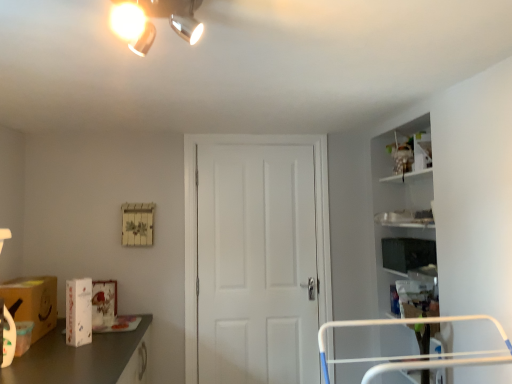
The image size is (512, 384). Describe the element at coordinates (407, 253) in the screenshot. I see `matte black tv at right, acting as the first box starting from the right` at that location.

The image size is (512, 384). What are the coordinates of `matte black tv at right, which ranks as the 1th box in back-to-front order` in the screenshot? It's located at (407, 253).

You are a GUI agent. You are given a task and a screenshot of the screen. Output one action in this format:
    pyautogui.click(x=<x>, y=<y>)
    Task: Click on the white matte door at center
    
    Given the screenshot: What is the action you would take?
    pyautogui.click(x=195, y=225)

Image resolution: width=512 pixels, height=384 pixels. What do you see at coordinates (32, 302) in the screenshot? I see `matte brown cardboard box at lower left` at bounding box center [32, 302].

Find the location of a particular element. The image size is (512, 384). white glossy box at lower left, positioned as the 2th box in top-to-bottom order is located at coordinates (88, 308).

Can you confirm if matte silver light fixture at upper center is shorter than white matte door at center?

Correct, matte silver light fixture at upper center is not as tall as white matte door at center.

Between matte silver light fixture at upper center and white matte door at center, which one appears on the left side from the viewer's perspective?

Positioned to the left is matte silver light fixture at upper center.

The width and height of the screenshot is (512, 384). In order to click on light fixture on the left of white matte door at center in this screenshot , I will do `click(152, 24)`.

Is matte silver light fixture at upper center next to white matte door at center and touching it?

They are not placed beside each other.

In terms of height, does white glossy box at lower left, which is the 1th box from front to back, look taller or shorter compared to matte silver light fixture at upper center?

white glossy box at lower left, which is the 1th box from front to back, is taller than matte silver light fixture at upper center.

Is white glossy box at lower left, placed as the first box when sorted from left to right, thinner than matte silver light fixture at upper center?

Yes.

Is point (116, 287) more distant than point (143, 37)?

Yes, point (116, 287) is behind point (143, 37).

What's the angular difference between white glossy box at lower left, which is the 1th box from front to back, and matte silver light fixture at upper center's facing directions?

The angular difference between white glossy box at lower left, which is the 1th box from front to back, and matte silver light fixture at upper center is 42.4 degrees.

Can you confirm if matte silver light fixture at upper center is smaller than matte black tv at right, which ranks as the 1th box in back-to-front order?

Indeed, matte silver light fixture at upper center has a smaller size compared to matte black tv at right, which ranks as the 1th box in back-to-front order.

Is matte silver light fixture at upper center at the right side of matte black tv at right, which ranks as the 1th box in back-to-front order?

No, matte silver light fixture at upper center is not to the right of matte black tv at right, which ranks as the 1th box in back-to-front order.

From the image's perspective, is matte silver light fixture at upper center positioned above or below matte black tv at right, the 2th box from the bottom?

matte silver light fixture at upper center is above matte black tv at right, the 2th box from the bottom.

How distant is matte silver light fixture at upper center from matte black tv at right, the 2th box from the bottom?

matte silver light fixture at upper center is 6.45 feet from matte black tv at right, the 2th box from the bottom.

What's the angular difference between white matte door at center and matte brown cardboard box at lower left's facing directions?

The angular difference between white matte door at center and matte brown cardboard box at lower left is 89.9 degrees.

Considering the relative sizes of white matte door at center and matte brown cardboard box at lower left in the image provided, is white matte door at center thinner than matte brown cardboard box at lower left?

Yes, white matte door at center is thinner than matte brown cardboard box at lower left.

Is white matte door at center inside the boundaries of matte brown cardboard box at lower left, or outside?

white matte door at center is outside matte brown cardboard box at lower left.

From the image's perspective, is white matte door at center on top of matte brown cardboard box at lower left?

Correct, white matte door at center appears higher than matte brown cardboard box at lower left in the image.

Is matte black tv at right, acting as the first box starting from the right, to the right of white glossy box at lower left, which is the 1th box from front to back, from the viewer's perspective?

Indeed, matte black tv at right, acting as the first box starting from the right, is positioned on the right side of white glossy box at lower left, which is the 1th box from front to back.

Between matte black tv at right, acting as the first box starting from the right, and white glossy box at lower left, positioned as the 2th box in top-to-bottom order, which one has larger width?

matte black tv at right, acting as the first box starting from the right.

Which is farther from the camera, [416,250] or [81,336]?

The point [416,250] is farther from the camera.

Is there a large distance between matte black tv at right, acting as the first box starting from the right, and white glossy box at lower left, which is the 1th box from front to back?

matte black tv at right, acting as the first box starting from the right, is positioned a significant distance from white glossy box at lower left, which is the 1th box from front to back.

Which is nearer, (44, 281) or (187, 31)?

Point (44, 281) is farther from the camera than point (187, 31).

Can you confirm if matte brown cardboard box at lower left is positioned to the left of matte silver light fixture at upper center?

Correct, you'll find matte brown cardboard box at lower left to the left of matte silver light fixture at upper center.

Is matte silver light fixture at upper center at the back of matte brown cardboard box at lower left?

matte brown cardboard box at lower left is not turned away from matte silver light fixture at upper center.

What's the angular difference between matte brown cardboard box at lower left and white glossy box at lower left, positioned as the 2th box in top-to-bottom order,'s facing directions?

There is a 43-degree angle between the facing directions of matte brown cardboard box at lower left and white glossy box at lower left, positioned as the 2th box in top-to-bottom order.

Consider the image. From a real-world perspective, between matte brown cardboard box at lower left and white glossy box at lower left, the second box when ordered from back to front, who is vertically higher?

white glossy box at lower left, the second box when ordered from back to front, from a real-world perspective.

From the image's perspective, which one is positioned lower, matte brown cardboard box at lower left or white glossy box at lower left, positioned as the 2th box in top-to-bottom order?

matte brown cardboard box at lower left appears lower in the image.

Is matte brown cardboard box at lower left facing towards white glossy box at lower left, placed as the first box when sorted from left to right?

Yes, matte brown cardboard box at lower left is turned towards white glossy box at lower left, placed as the first box when sorted from left to right.

Locate an element on the screen. The image size is (512, 384). door lying on the right of matte silver light fixture at upper center is located at coordinates (195, 225).

The width and height of the screenshot is (512, 384). What are the coordinates of `light fixture lying in front of the white glossy box at lower left, positioned as the 2th box in top-to-bottom order` in the screenshot? It's located at (152, 24).

From the image, which object appears to be nearer to matte silver light fixture at upper center, white glossy box at lower left, which is the 1th box from front to back, or matte brown cardboard box at lower left?

white glossy box at lower left, which is the 1th box from front to back, lies closer to matte silver light fixture at upper center than the other object.

Estimate the real-world distances between objects in this image. Which object is further from white matte door at center, white glossy box at lower left, which ranks as the first box in bottom-to-top order, or matte brown cardboard box at lower left?

matte brown cardboard box at lower left.

When comparing their distances from white glossy box at lower left, arranged as the 2th box when viewed from the right, does matte black tv at right, which ranks as the 1th box in back-to-front order, or matte brown cardboard box at lower left seem further?

matte black tv at right, which ranks as the 1th box in back-to-front order, lies further to white glossy box at lower left, arranged as the 2th box when viewed from the right, than the other object.

Estimate the real-world distances between objects in this image. Which object is further from matte black tv at right, acting as the first box starting from the right, white matte door at center or matte silver light fixture at upper center?

matte silver light fixture at upper center lies further to matte black tv at right, acting as the first box starting from the right, than the other object.

Based on the photo, from the image, which object appears to be nearer to white glossy box at lower left, which is the 1th box from front to back, white matte door at center or matte black tv at right, marked as the 2th box in a left-to-right arrangement?

Based on the image, white matte door at center appears to be nearer to white glossy box at lower left, which is the 1th box from front to back.

Based on their spatial positions, is matte brown cardboard box at lower left or white matte door at center further from matte silver light fixture at upper center?

The object further to matte silver light fixture at upper center is white matte door at center.

From the image, which object appears to be farther from matte brown cardboard box at lower left, white glossy box at lower left, which ranks as the first box in bottom-to-top order, or matte black tv at right, which ranks as the 1th box in back-to-front order?

The object further to matte brown cardboard box at lower left is matte black tv at right, which ranks as the 1th box in back-to-front order.

Estimate the real-world distances between objects in this image. Which object is closer to white matte door at center, matte brown cardboard box at lower left or matte silver light fixture at upper center?

matte brown cardboard box at lower left.

Where is `light fixture situated between matte brown cardboard box at lower left and matte black tv at right, the 2th box viewed from the front, from left to right`? light fixture situated between matte brown cardboard box at lower left and matte black tv at right, the 2th box viewed from the front, from left to right is located at coordinates (152, 24).

Locate an element on the screen. This screenshot has width=512, height=384. door located between white glossy box at lower left, arranged as the 2th box when viewed from the right, and matte black tv at right, which ranks as the 1th box in back-to-front order, in the left-right direction is located at coordinates (195, 225).

Locate an element on the screen. Image resolution: width=512 pixels, height=384 pixels. box between matte brown cardboard box at lower left and matte black tv at right, marked as the 2th box in a left-to-right arrangement, in the horizontal direction is located at coordinates (88, 308).

The image size is (512, 384). I want to click on box between matte brown cardboard box at lower left and white matte door at center, so click(88, 308).